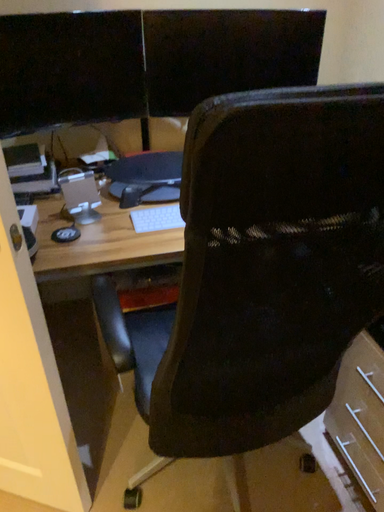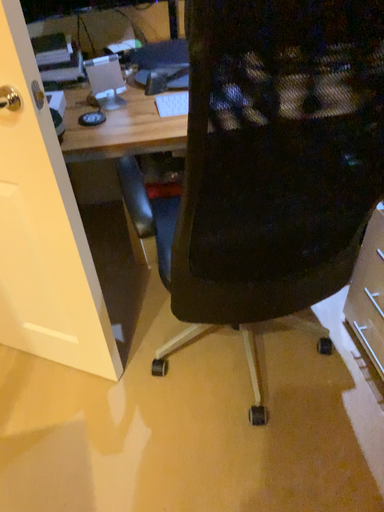
Question: How did the camera likely rotate when shooting the video?

Choices:
 (A) rotated upward
 (B) rotated downward

Answer: (B)